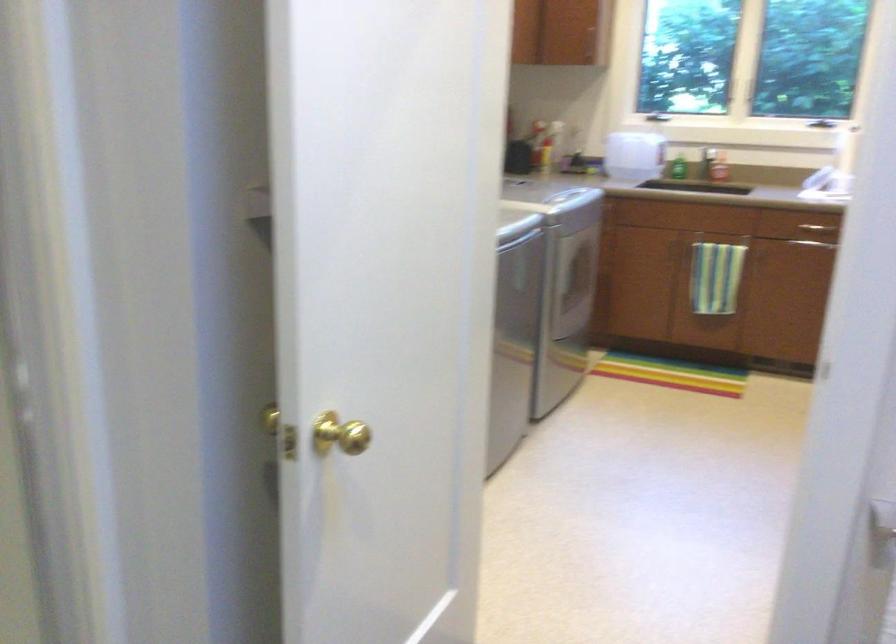
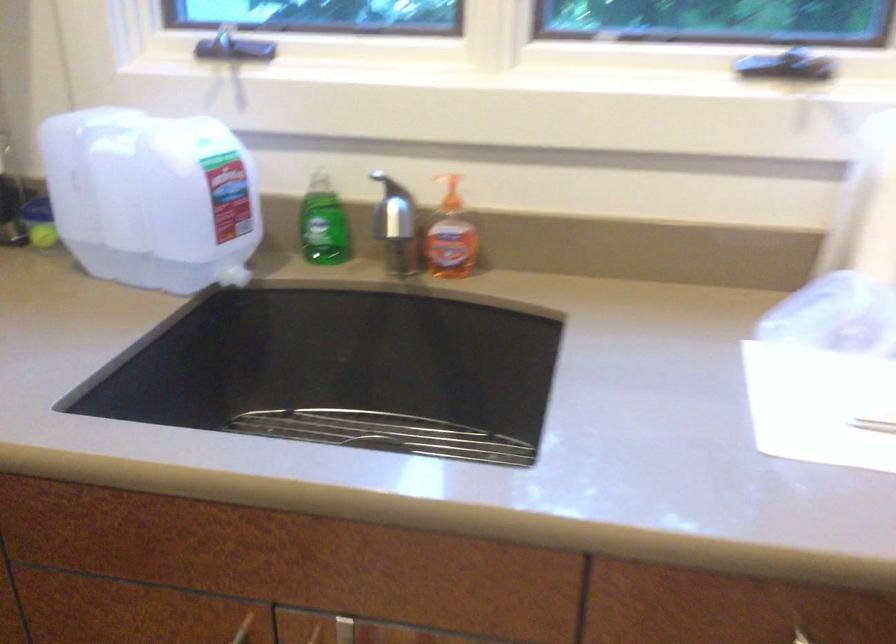
Where in the second image is the point corresponding to (x=656, y=129) from the first image?

(220, 135)